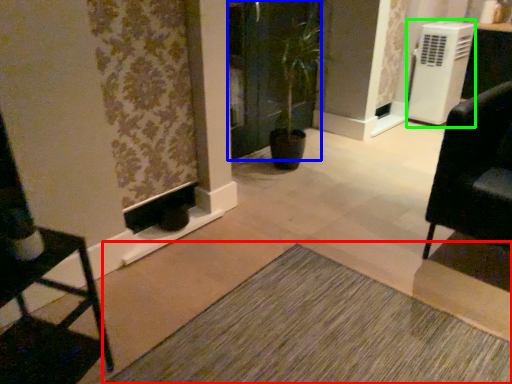
Question: Which is nearer to the doormat (highlighted by a red box)? screen door (highlighted by a blue box) or air conditioning (highlighted by a green box).

Choices:
 (A) screen door
 (B) air conditioning

Answer: (A)